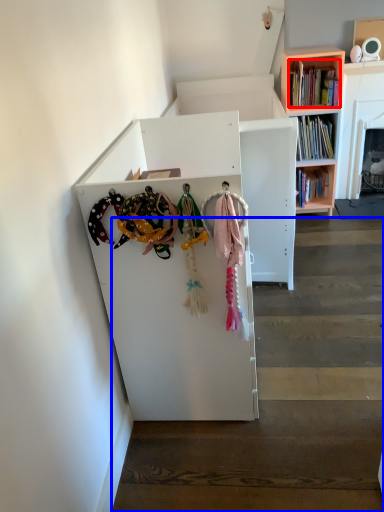
Question: Which point is further to the camera, book (highlighted by a red box) or stairwell (highlighted by a blue box)?

Choices:
 (A) book
 (B) stairwell

Answer: (A)